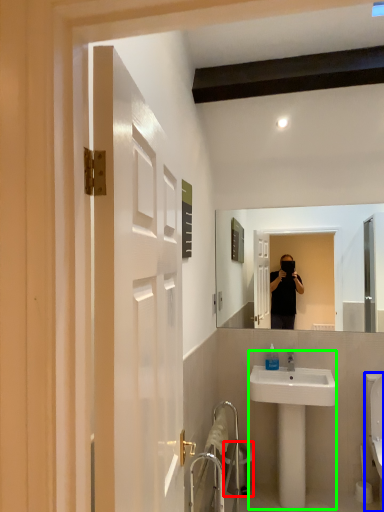
Question: Which object is the farthest from trash bin/can (highlighted by a red box)? Choose among these: toilet (highlighted by a blue box) or sink (highlighted by a green box).

Choices:
 (A) toilet
 (B) sink

Answer: (A)